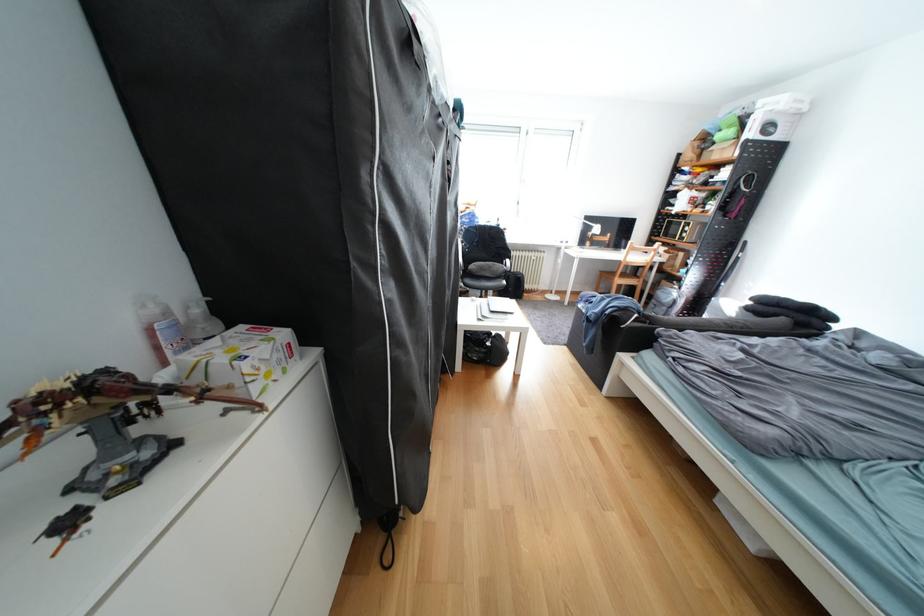
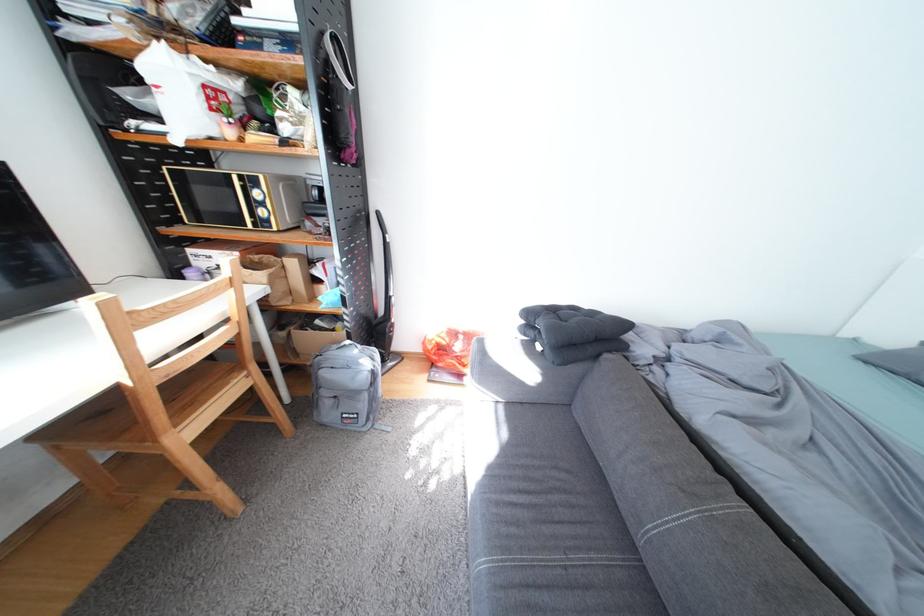
Find the pixel in the second image that matches pixel 681 261 in the first image.

(285, 284)